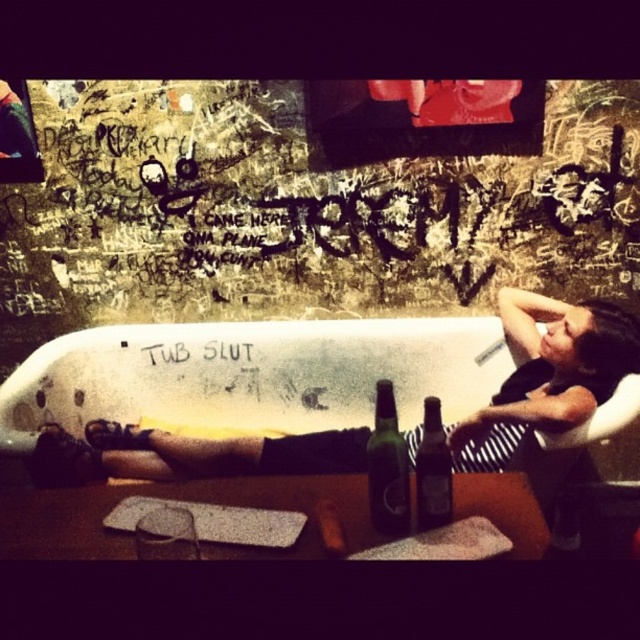
Question: Which object appears closest to the camera in this image?

Choices:
 (A) black fabric shirt at center
 (B) brown glass bottle at center
 (C) green glass bottle at center

Answer: (B)

Question: Based on their relative distances, which object is farther from the green glass bottle at center?

Choices:
 (A) brown glass bottle at center
 (B) black fabric shirt at center

Answer: (B)

Question: Considering the real-world distances, which object is farthest from the green glass bottle at center?

Choices:
 (A) brown glass bottle at center
 (B) black fabric shirt at center

Answer: (B)

Question: Can you confirm if black fabric shirt at center is thinner than green glass bottle at center?

Choices:
 (A) yes
 (B) no

Answer: (B)

Question: Can you confirm if black fabric shirt at center is positioned above brown glass bottle at center?

Choices:
 (A) no
 (B) yes

Answer: (A)

Question: Is black fabric shirt at center positioned in front of brown glass bottle at center?

Choices:
 (A) yes
 (B) no

Answer: (B)